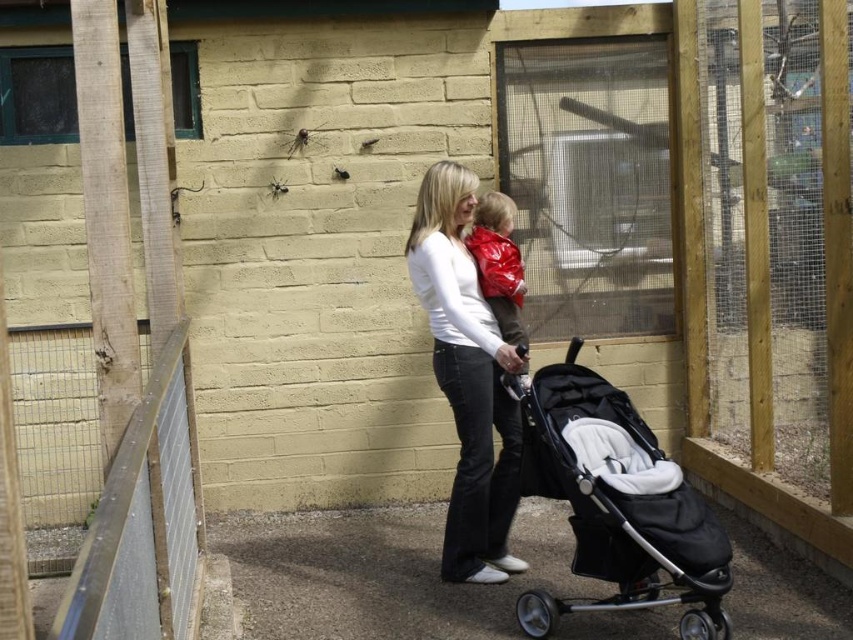
Question: Considering the relative positions of black fabric stroller at lower right and shiny red jacket at center in the image provided, where is black fabric stroller at lower right located with respect to shiny red jacket at center?

Choices:
 (A) above
 (B) below

Answer: (B)

Question: Which object is positioned closest to the clear mesh screen door at center?

Choices:
 (A) black fabric stroller at lower right
 (B) shiny red jacket at center
 (C) white matte shirt at center

Answer: (B)

Question: Which point is farther to the camera?

Choices:
 (A) (442, 243)
 (B) (535, 449)
 (C) (663, 202)

Answer: (C)

Question: Can you confirm if clear mesh screen door at center is wider than white matte shirt at center?

Choices:
 (A) no
 (B) yes

Answer: (B)

Question: Which point is closer to the camera?

Choices:
 (A) (506, 381)
 (B) (485, 364)
 (C) (508, 294)

Answer: (A)

Question: Is black fabric stroller at lower right further to camera compared to white matte shirt at center?

Choices:
 (A) yes
 (B) no

Answer: (B)